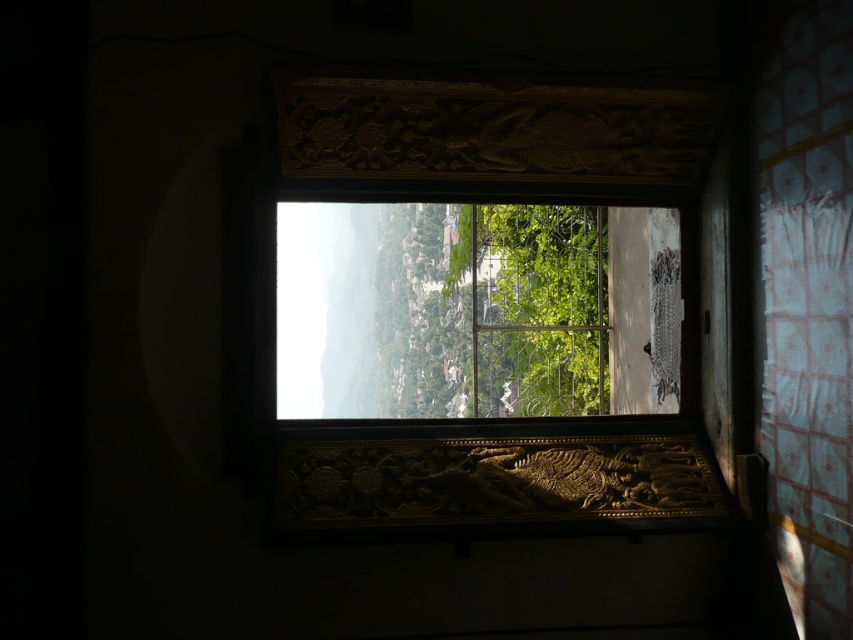
You are an interior designer assessing the window decorations. You notice the gold carved wood at center and the green leafy tree at center. Which object appears smaller in the scene?

The gold carved wood at center has a smaller size compared to the green leafy tree at center, so the gold carved wood at center appears smaller.

You are standing inside the room looking through the window. You notice the gold carved wood at center and the green leafy tree at center. Which object is closer to you?

The gold carved wood at center is closer to you because it is part of the window frame inside the room, while the green leafy tree at center is outside the window and farther away.

You are an interior designer assessing the placement of the gold carved wood at center in the window frame. Based on its coordinates, would you say it is positioned closer to the bottom or the top of the window frame?

The gold carved wood at center is positioned closer to the bottom of the window frame since its y coordinate is 0.578, which is below the midpoint of 0.5.